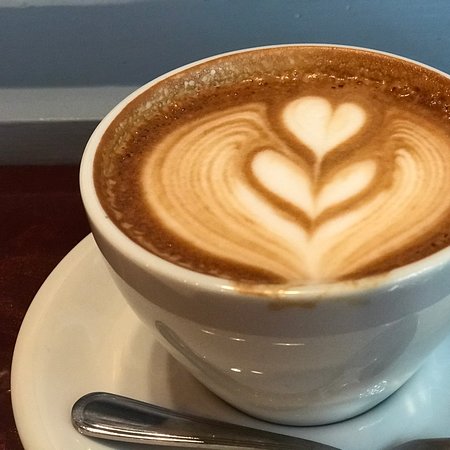
What are the coordinates of `wall` in the screenshot? It's located at click(x=72, y=39).